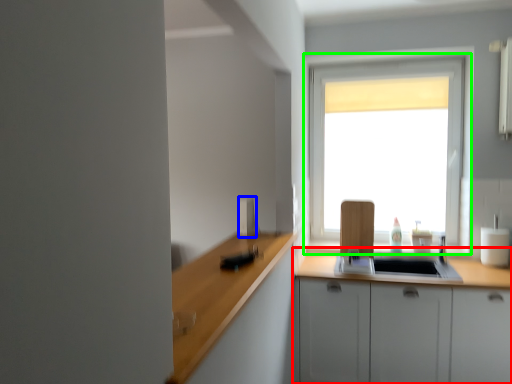
Question: Considering the real-world distances, which object is farthest from cabinetry (highlighted by a red box)? appliance (highlighted by a blue box) or window (highlighted by a green box)?

Choices:
 (A) appliance
 (B) window

Answer: (A)